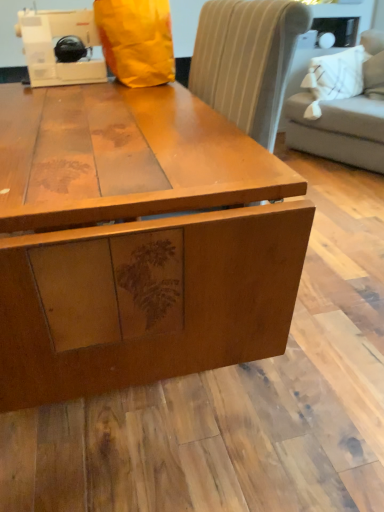
Question: Does light gray fabric couch at upper right have a lesser height compared to matte wood table at center?

Choices:
 (A) no
 (B) yes

Answer: (A)

Question: From a real-world perspective, is light gray fabric couch at upper right over matte wood table at center?

Choices:
 (A) no
 (B) yes

Answer: (B)

Question: From a real-world perspective, is light gray fabric couch at upper right positioned under matte wood table at center based on gravity?

Choices:
 (A) yes
 (B) no

Answer: (B)

Question: Does light gray fabric couch at upper right have a lesser width compared to matte wood table at center?

Choices:
 (A) yes
 (B) no

Answer: (A)

Question: Can matte wood table at center be found inside light gray fabric couch at upper right?

Choices:
 (A) no
 (B) yes

Answer: (A)

Question: Considering the positions of matte wood table at center and white plastic sewing machine at upper left in the image, is matte wood table at center taller or shorter than white plastic sewing machine at upper left?

Choices:
 (A) tall
 (B) short

Answer: (B)

Question: Considering the positions of matte wood table at center and white plastic sewing machine at upper left in the image, is matte wood table at center bigger or smaller than white plastic sewing machine at upper left?

Choices:
 (A) small
 (B) big

Answer: (B)

Question: Is point (52, 178) closer or farther from the camera than point (31, 69)?

Choices:
 (A) farther
 (B) closer

Answer: (B)

Question: In terms of width, does matte wood table at center look wider or thinner when compared to white plastic sewing machine at upper left?

Choices:
 (A) wide
 (B) thin

Answer: (A)

Question: In terms of height, does matte wood table at center look taller or shorter compared to light gray fabric couch at upper right?

Choices:
 (A) tall
 (B) short

Answer: (B)

Question: From the image's perspective, is matte wood table at center positioned above or below light gray fabric couch at upper right?

Choices:
 (A) above
 (B) below

Answer: (B)

Question: Visually, is matte wood table at center positioned to the left or to the right of light gray fabric couch at upper right?

Choices:
 (A) left
 (B) right

Answer: (A)

Question: Relative to light gray fabric couch at upper right, is matte wood table at center in front or behind?

Choices:
 (A) front
 (B) behind

Answer: (A)

Question: In terms of width, does light gray fabric couch at upper right look wider or thinner when compared to matte wood table at center?

Choices:
 (A) wide
 (B) thin

Answer: (B)

Question: From a real-world perspective, is light gray fabric couch at upper right above or below matte wood table at center?

Choices:
 (A) above
 (B) below

Answer: (A)